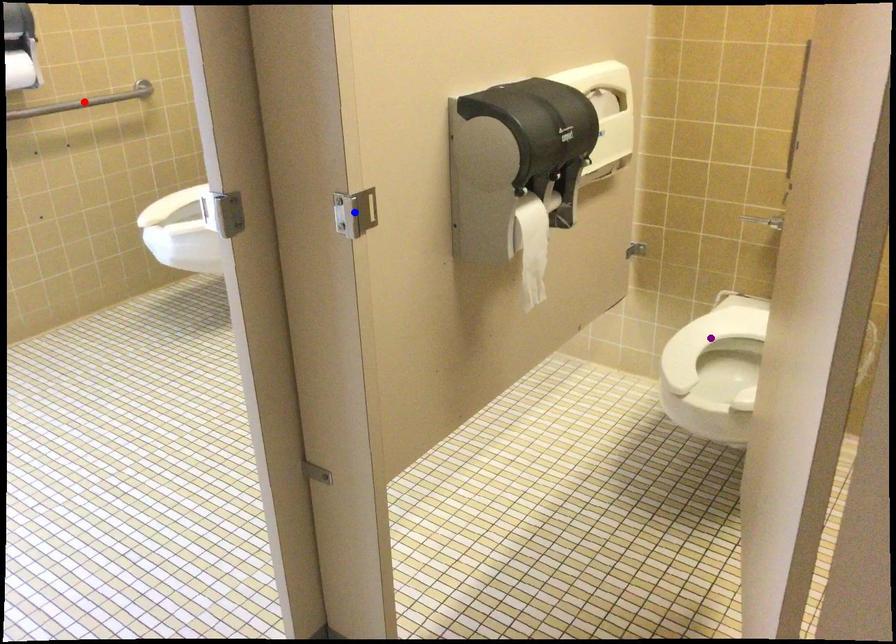
Order these from nearest to farthest:
- purple point
- blue point
- red point

red point → purple point → blue point